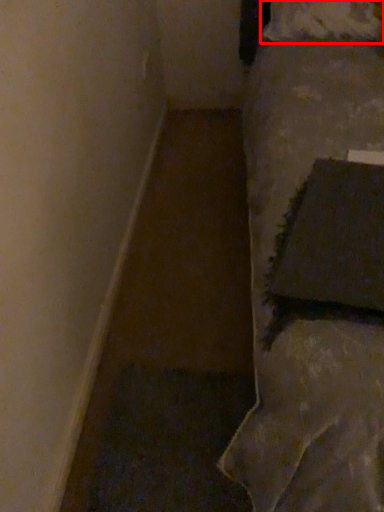
Question: Observing the image, what is the correct spatial positioning of pillow (annotated by the red box) in reference to pillow?

Choices:
 (A) right
 (B) left

Answer: (A)